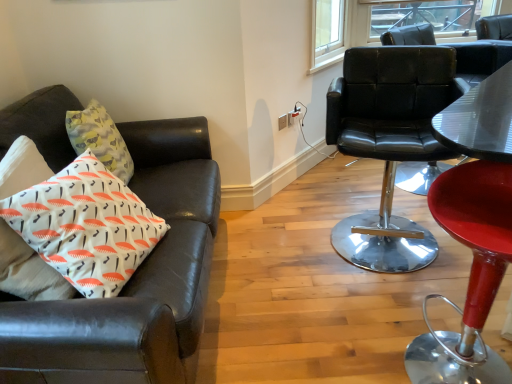
Identify the location of vacant space behind red leather bar stool at right, the first chair in the right-to-left sequence. The width and height of the screenshot is (512, 384). (402, 309).